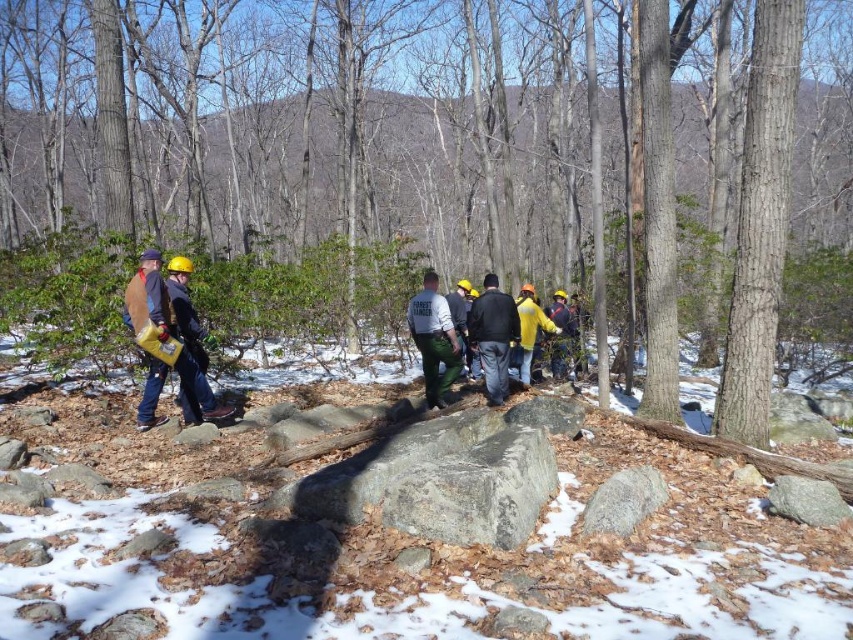
You are a member of the work crew in the forest. You need to locate the rough bark tree at center for a safety inspection. According to the map coordinates provided, where should you look to find it?

The rough bark tree at center is located at point (x=759, y=224).